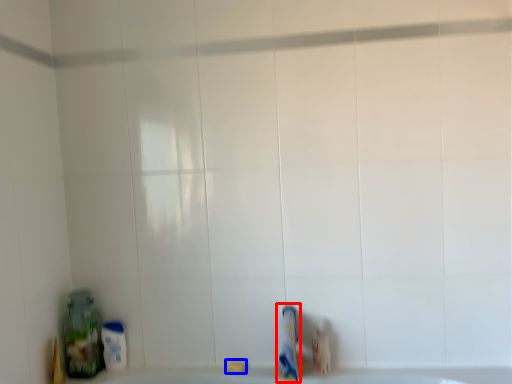
Question: Which object is further to the camera taking this photo, toothpaste (highlighted by a red box) or soap (highlighted by a blue box)?

Choices:
 (A) toothpaste
 (B) soap

Answer: (B)